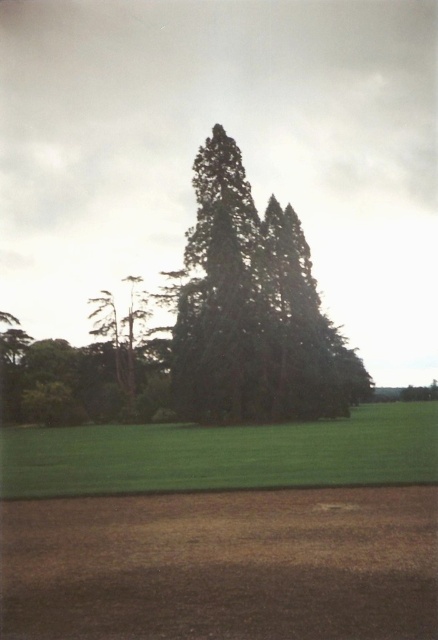
Question: Which is nearer to the brown soil at lower center?

Choices:
 (A) dark green textured tree at center
 (B) green grass at lower center

Answer: (B)

Question: Is dark green textured tree at center closer to camera compared to green grass at lower center?

Choices:
 (A) no
 (B) yes

Answer: (A)

Question: Among these points, which one is nearest to the camera?

Choices:
 (A) (416, 442)
 (B) (275, 252)

Answer: (A)

Question: Does dark green textured tree at center lie behind green grass at lower center?

Choices:
 (A) yes
 (B) no

Answer: (A)

Question: Is brown soil at lower center behind green grass at lower center?

Choices:
 (A) yes
 (B) no

Answer: (B)

Question: Which of the following is the closest to the observer?

Choices:
 (A) (77, 368)
 (B) (82, 612)

Answer: (B)